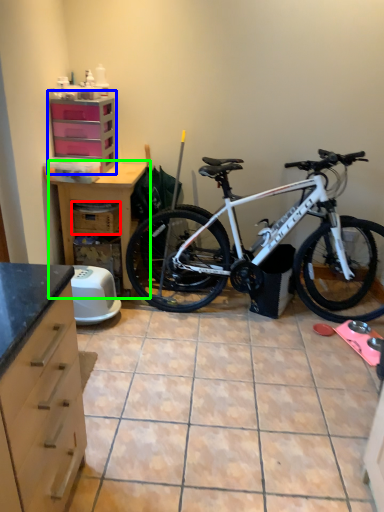
Question: Based on their relative distances, which object is farther from crate (highlighted by a red box)? Choose from file cabinet (highlighted by a blue box) and table (highlighted by a green box).

Choices:
 (A) file cabinet
 (B) table

Answer: (A)